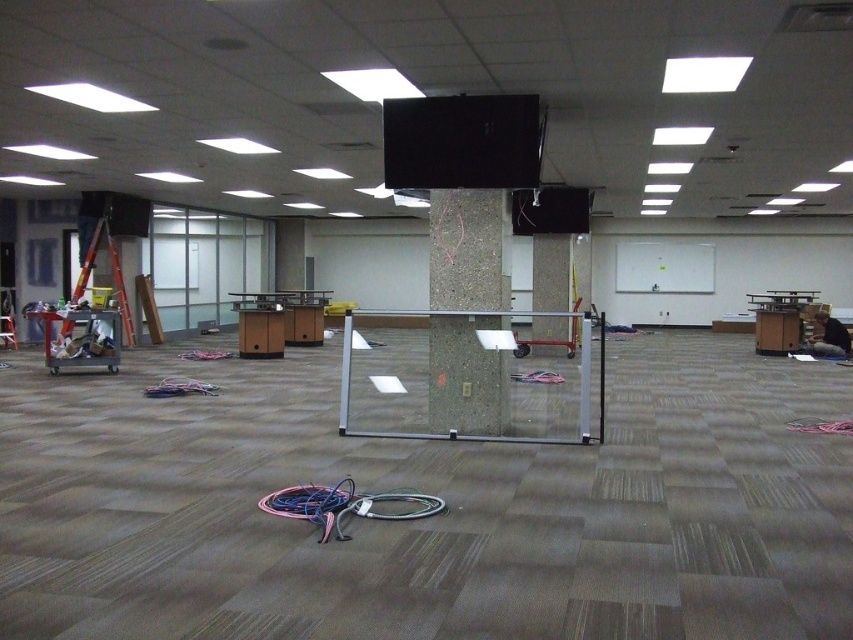
Does point (440, 378) come closer to viewer compared to point (546, 272)?

Yes.

Is point (502, 189) closer to viewer compared to point (552, 276)?

Yes, point (502, 189) is in front of point (552, 276).

Identify the location of concrete at center. The image size is (853, 640). (469, 250).